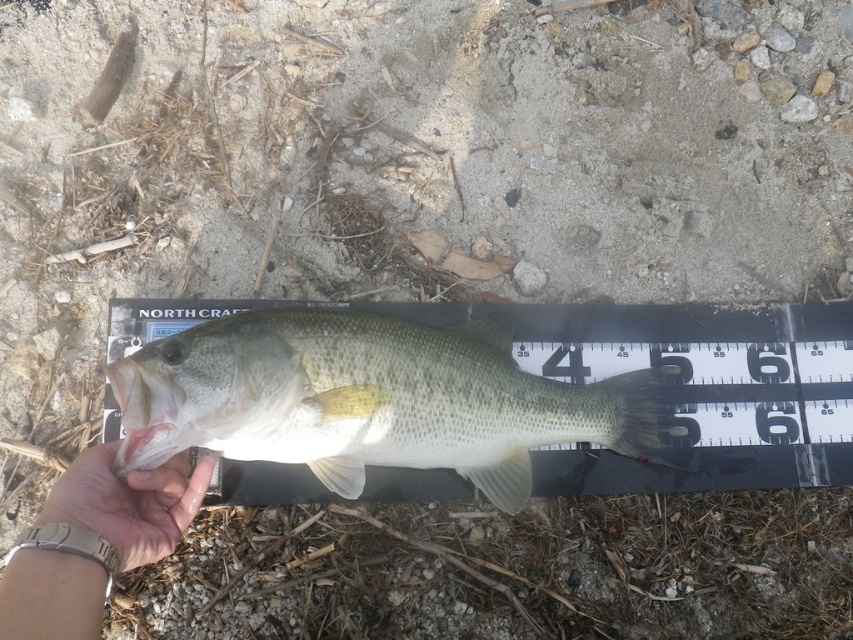
Question: Does green matte fish at center have a larger size compared to satin gold watch at lower left?

Choices:
 (A) yes
 (B) no

Answer: (A)

Question: Is green matte fish at center wider than satin gold watch at lower left?

Choices:
 (A) no
 (B) yes

Answer: (B)

Question: Which of the following is the farthest from the observer?

Choices:
 (A) green matte fish at center
 (B) satin gold watch at lower left

Answer: (A)

Question: Which object appears closest to the camera in this image?

Choices:
 (A) satin gold watch at lower left
 (B) green matte fish at center

Answer: (A)

Question: Does green matte fish at center appear on the left side of satin gold watch at lower left?

Choices:
 (A) yes
 (B) no

Answer: (B)